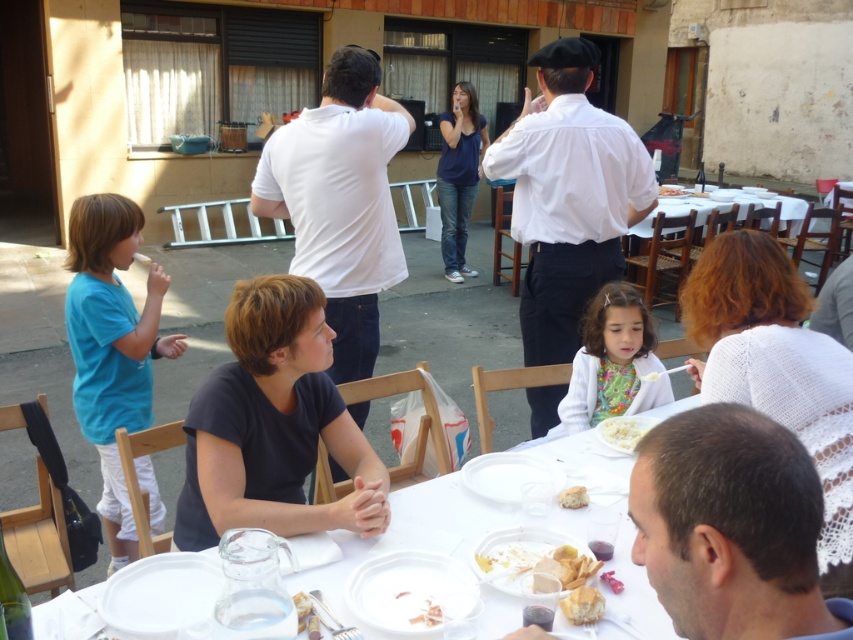
Question: Which point is farther to the camera?

Choices:
 (A) (215, 592)
 (B) (787, 509)
 (C) (132, 227)

Answer: (C)

Question: Which point is farther from the camera taking this photo?

Choices:
 (A) (740, 634)
 (B) (566, 605)

Answer: (B)

Question: Is matte white sweater at lower center smaller than smooth white cheese at lower center?

Choices:
 (A) no
 (B) yes

Answer: (A)

Question: Does white cotton shirt at center have a lesser width compared to matte white sweater at lower center?

Choices:
 (A) yes
 (B) no

Answer: (B)

Question: Does white plastic table at center appear under smooth white cheese at lower center?

Choices:
 (A) no
 (B) yes

Answer: (B)

Question: Which of the following is the closest to the observer?

Choices:
 (A) (305, 248)
 (B) (585, 499)

Answer: (B)